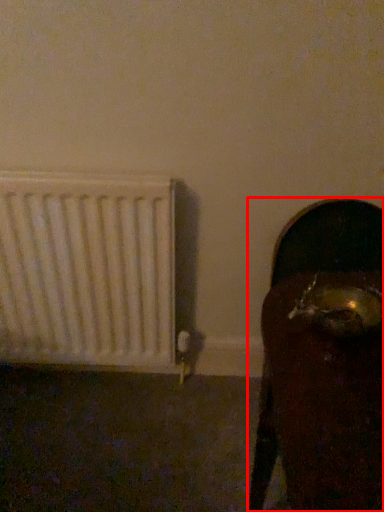
Question: Considering the relative positions of furniture (annotated by the red box) and radiator in the image provided, where is furniture (annotated by the red box) located with respect to the staircase?

Choices:
 (A) left
 (B) right

Answer: (B)